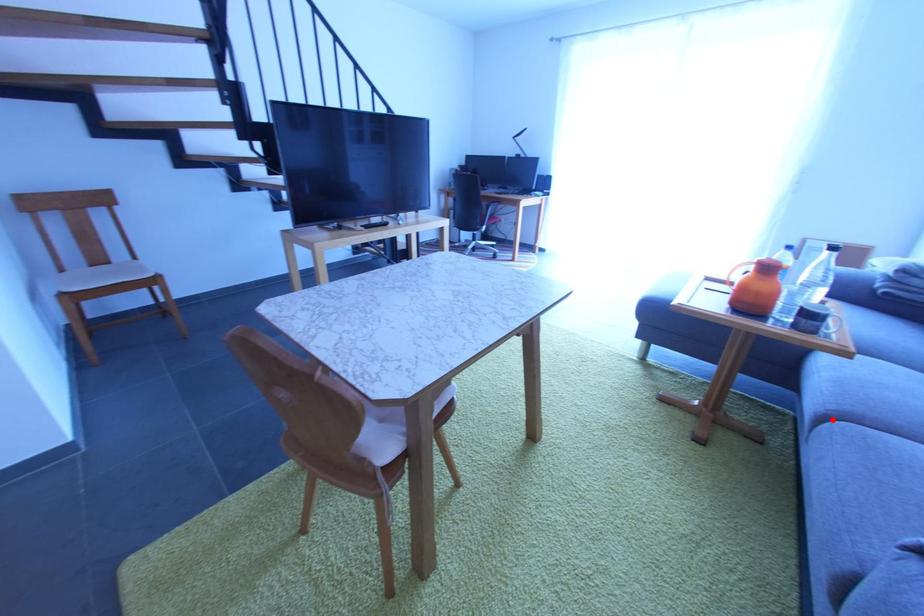
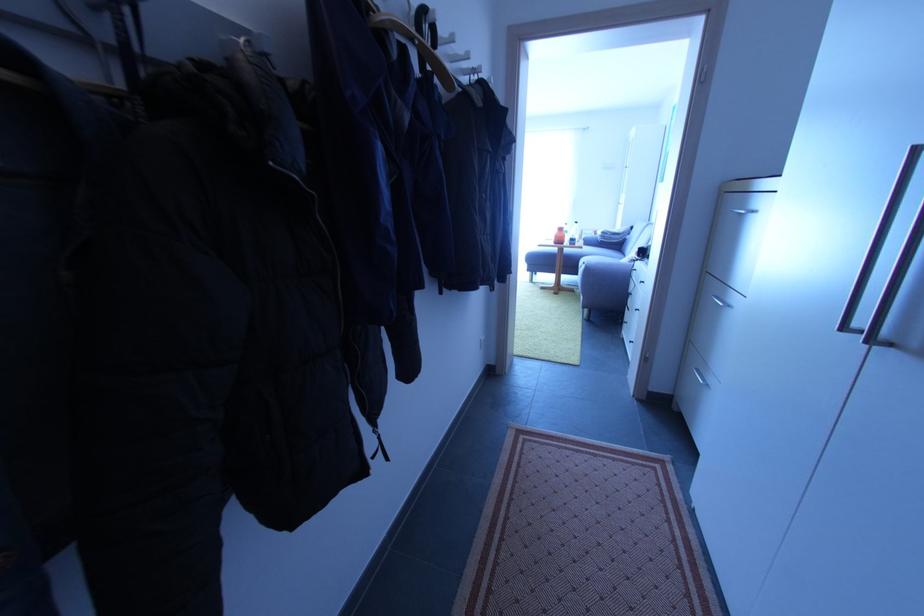
Question: A red point is marked in image1. In image2, is the corresponding 3D point closer to the camera or farther? Reply with the corresponding letter.

Choices:
 (A) The corresponding 3D point is closer.
 (B) The corresponding 3D point is farther.

Answer: (A)